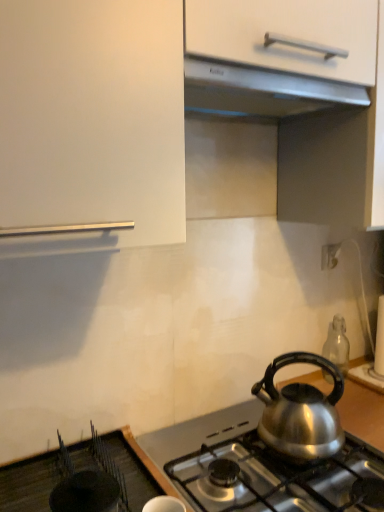
Question: Is point (221, 110) closer or farther from the camera than point (337, 330)?

Choices:
 (A) closer
 (B) farther

Answer: (A)

Question: Visually, is satin silver exhaust hood at upper center positioned to the left or to the right of transparent glass bottle at lower right?

Choices:
 (A) right
 (B) left

Answer: (B)

Question: Which object is positioned closest to the satin silver gas stove at lower center?

Choices:
 (A) shiny metallic kettle at lower right
 (B) satin silver exhaust hood at upper center
 (C) white plastic electric outlet at upper right
 (D) transparent glass bottle at lower right

Answer: (A)

Question: Which object is the farthest from the transparent glass bottle at lower right?

Choices:
 (A) satin silver exhaust hood at upper center
 (B) satin silver gas stove at lower center
 (C) white plastic electric outlet at upper right
 (D) shiny metallic kettle at lower right

Answer: (A)